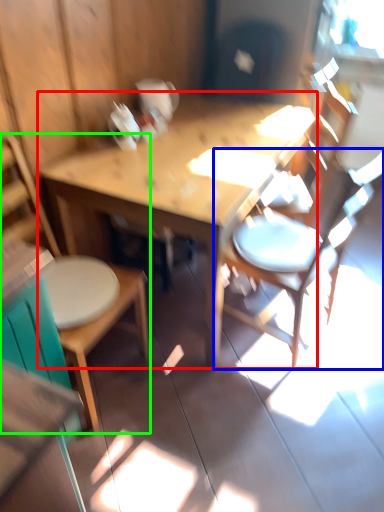
Question: Which object is positioned closest to table (highlighted by a red box)? Select from chair (highlighted by a blue box) and chair (highlighted by a green box).

Choices:
 (A) chair
 (B) chair

Answer: (A)